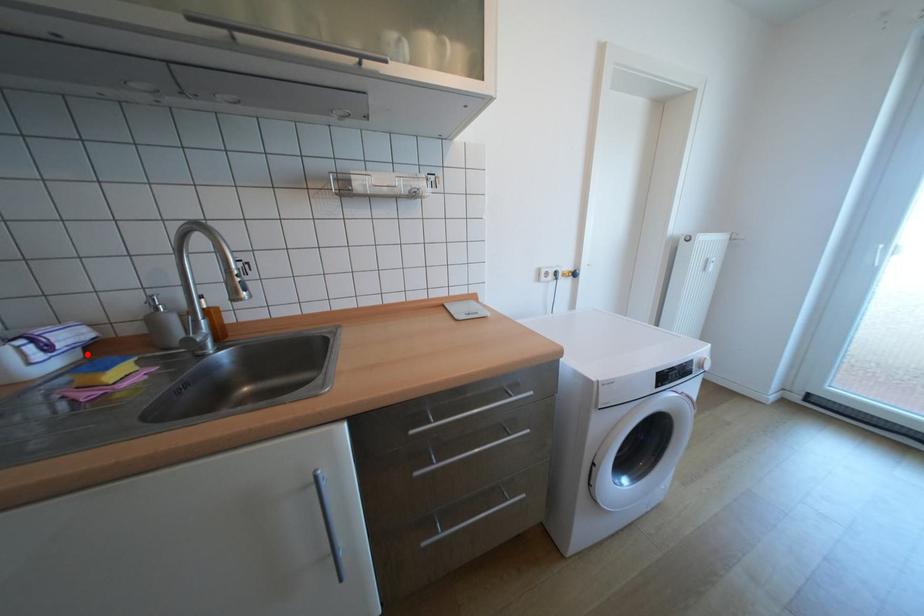
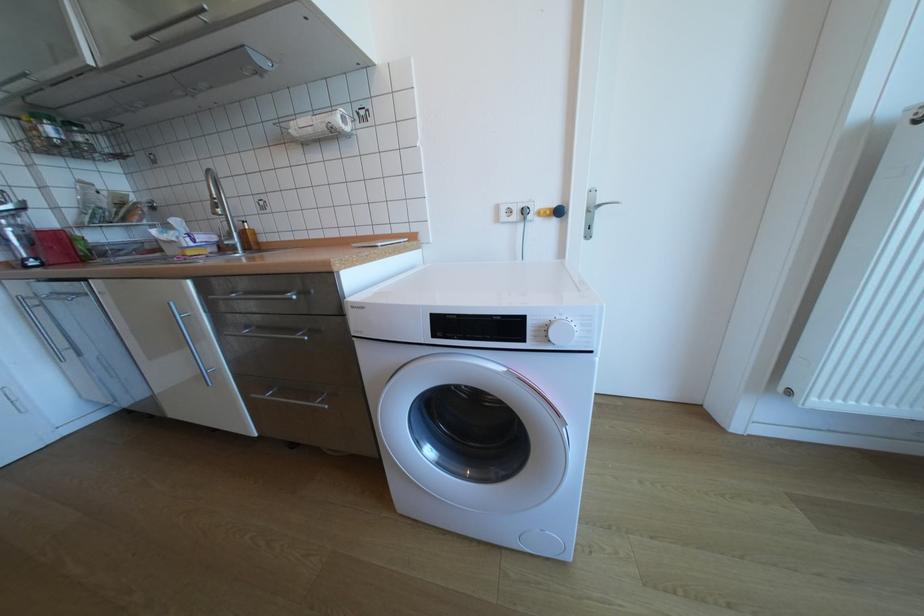
In the second image, find the point that corresponds to the highlighted location in the first image.

(224, 249)